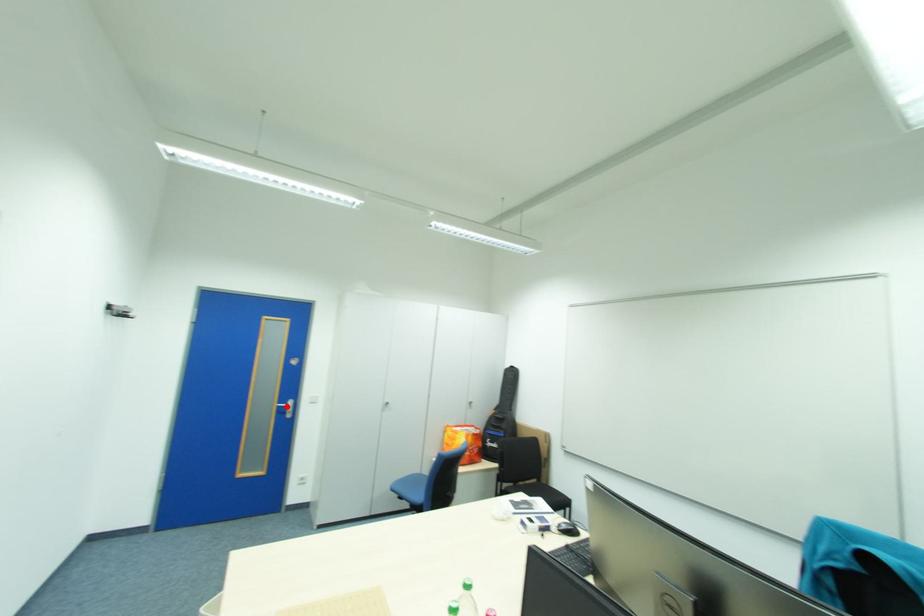
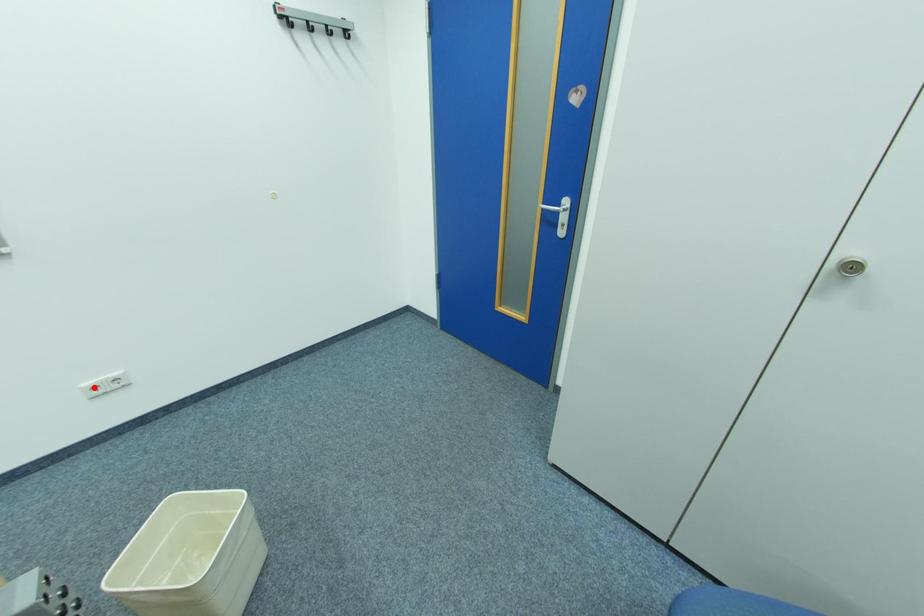
Looking at this image, I am providing you with two images of the same scene from different viewpoints. A red point is marked on the first image and another point is marked on the second image. Is the marked point in image1 the same physical position as the marked point in image2?

No